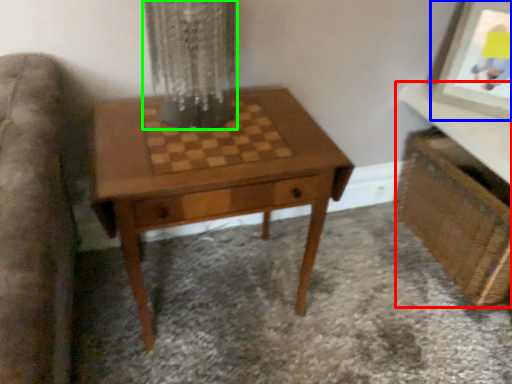
Question: Based on their relative distances, which object is nearer to vanity (highlighted by a red box)? Choose from picture frame (highlighted by a blue box) and glass vase (highlighted by a green box).

Choices:
 (A) picture frame
 (B) glass vase

Answer: (A)